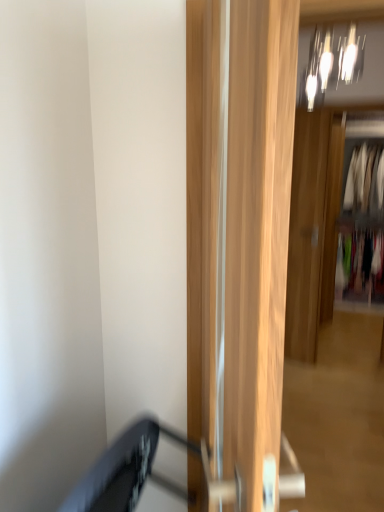
Question: Is wooden door at center, acting as the first door starting from the back, positioned with its back to white fabric clothes at right, which is the second clothing from top to bottom?

Choices:
 (A) no
 (B) yes

Answer: (B)

Question: Considering the relative sizes of wooden door at center, which is the second door from left to right, and white fabric clothes at right, positioned as the 2th clothing in bottom-to-top order, in the image provided, is wooden door at center, which is the second door from left to right, wider than white fabric clothes at right, positioned as the 2th clothing in bottom-to-top order,?

Choices:
 (A) no
 (B) yes

Answer: (A)

Question: Considering the relative sizes of wooden door at center, acting as the first door starting from the back, and white fabric clothes at right, which is the second clothing from top to bottom, in the image provided, is wooden door at center, acting as the first door starting from the back, shorter than white fabric clothes at right, which is the second clothing from top to bottom,?

Choices:
 (A) yes
 (B) no

Answer: (B)

Question: Is the surface of wooden door at center, which is the second door from left to right, in direct contact with white fabric clothes at right, which is the second clothing from top to bottom?

Choices:
 (A) yes
 (B) no

Answer: (B)

Question: Does wooden door at center, arranged as the 2th door when viewed from the front, have a greater height compared to white fabric clothes at right, which is the second clothing from top to bottom?

Choices:
 (A) no
 (B) yes

Answer: (B)

Question: Is wooden door at center, which is the second door from left to right, positioned far away from white fabric clothes at right, which is the second clothing from top to bottom?

Choices:
 (A) yes
 (B) no

Answer: (A)

Question: Is metallic glass light fixture at upper center closer to camera compared to light wood door at center, the first door in the left-to-right sequence?

Choices:
 (A) no
 (B) yes

Answer: (A)

Question: From a real-world perspective, is metallic glass light fixture at upper center physically above light wood door at center, acting as the 1th door starting from the front?

Choices:
 (A) no
 (B) yes

Answer: (B)

Question: Can you confirm if metallic glass light fixture at upper center is smaller than light wood door at center, the first door in the left-to-right sequence?

Choices:
 (A) yes
 (B) no

Answer: (A)

Question: Considering the relative sizes of metallic glass light fixture at upper center and light wood door at center, acting as the 1th door starting from the front, in the image provided, is metallic glass light fixture at upper center wider than light wood door at center, acting as the 1th door starting from the front,?

Choices:
 (A) no
 (B) yes

Answer: (B)

Question: From the image's perspective, is metallic glass light fixture at upper center on top of light wood door at center, the first door in the left-to-right sequence?

Choices:
 (A) yes
 (B) no

Answer: (A)

Question: Does metallic glass light fixture at upper center appear on the right side of light wood door at center, arranged as the second door when viewed from the back?

Choices:
 (A) yes
 (B) no

Answer: (A)

Question: Is multicolored fabric at right, the 1th clothing from the bottom, to the left of light wood door at center, the second door in the right-to-left sequence, from the viewer's perspective?

Choices:
 (A) yes
 (B) no

Answer: (B)